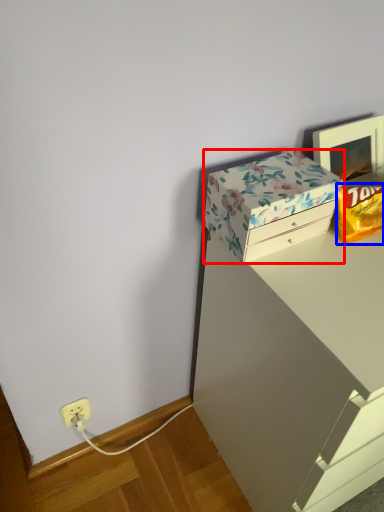
Question: Among these objects, which one is nearest to the camera, box (highlighted by a red box) or wrapping paper (highlighted by a blue box)?

Choices:
 (A) box
 (B) wrapping paper

Answer: (A)